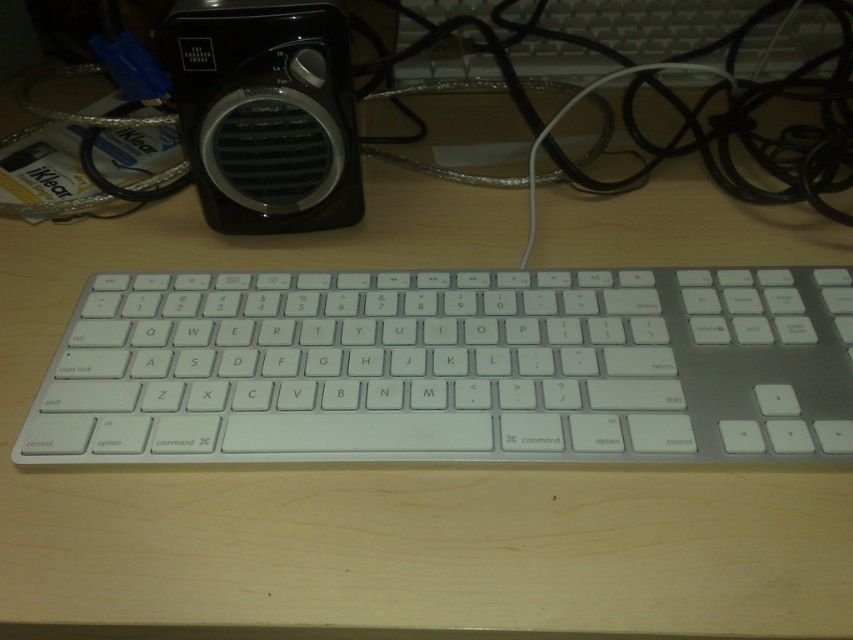
Which is more to the left, sleek silver keyboard at center or black plastic speaker at upper left?

black plastic speaker at upper left

Does sleek silver keyboard at center come behind black plastic speaker at upper left?

No, sleek silver keyboard at center is closer to the viewer.

The image size is (853, 640). What are the coordinates of `sleek silver keyboard at center` in the screenshot? It's located at (451, 368).

Locate an element on the screen. sleek silver keyboard at center is located at coordinates (451, 368).